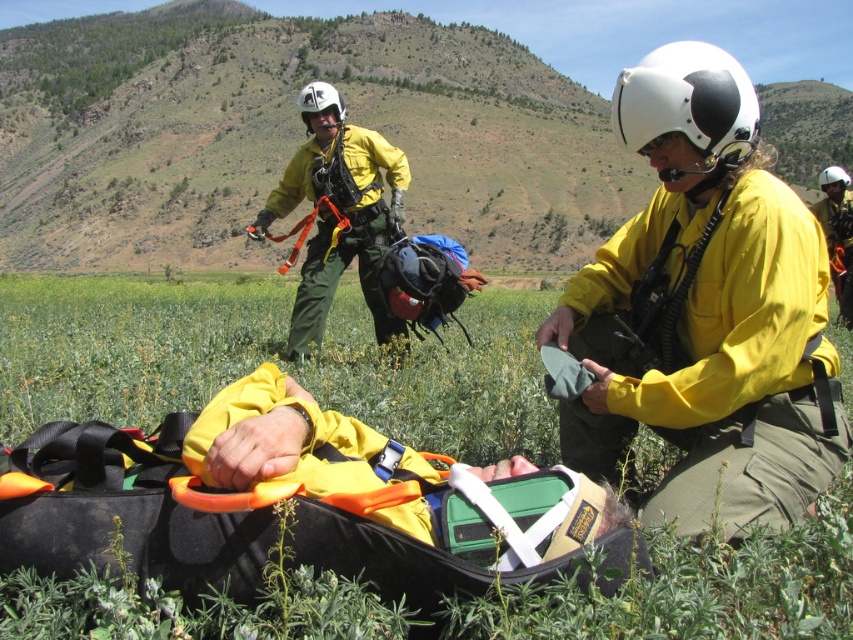
Question: Based on their relative distances, which object is nearer to the yellow matte helmet at upper center?

Choices:
 (A) yellow fabric helmet at upper right
 (B) yellow matte helmet at center

Answer: (B)

Question: From the image, what is the correct spatial relationship of green grassy at lower center in relation to yellow matte helmet at center?

Choices:
 (A) right
 (B) left

Answer: (B)

Question: Among these objects, which one is nearest to the camera?

Choices:
 (A) yellow matte helmet at upper center
 (B) yellow fabric helmet at upper right
 (C) yellow matte helmet at center
 (D) green grassy at lower center

Answer: (D)

Question: Is green grassy at lower center thinner than yellow matte helmet at center?

Choices:
 (A) no
 (B) yes

Answer: (A)

Question: Is yellow matte helmet at center to the left of yellow matte helmet at upper center from the viewer's perspective?

Choices:
 (A) yes
 (B) no

Answer: (B)

Question: Which object is farther from the camera taking this photo?

Choices:
 (A) yellow matte helmet at center
 (B) green grassy at lower center

Answer: (A)